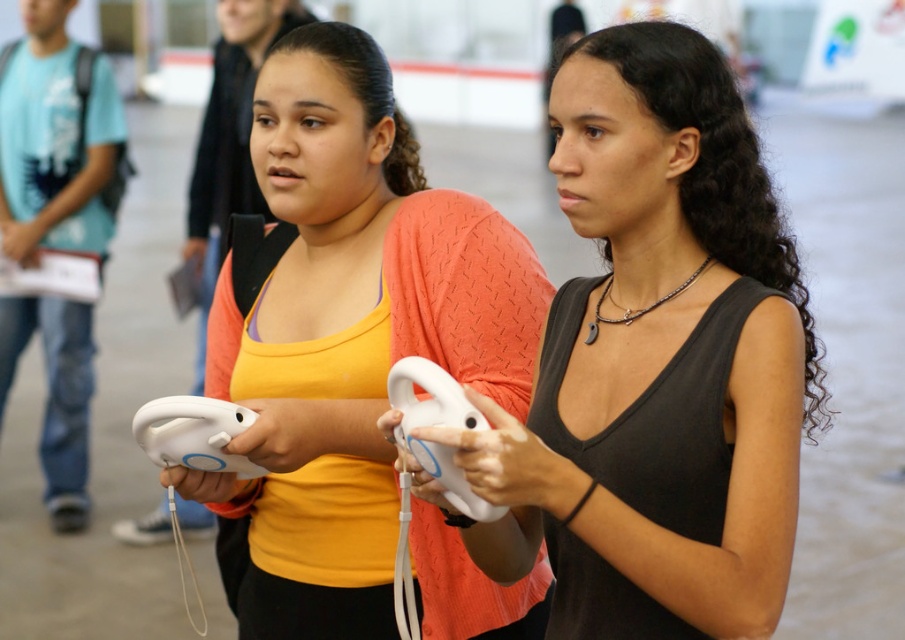
The width and height of the screenshot is (905, 640). I want to click on black matte tank top at center, so click(x=656, y=362).

Can you confirm if black matte tank top at center is taller than white matte wii controller at center?

Indeed, black matte tank top at center has a greater height compared to white matte wii controller at center.

This screenshot has height=640, width=905. What do you see at coordinates (656, 362) in the screenshot?
I see `black matte tank top at center` at bounding box center [656, 362].

Image resolution: width=905 pixels, height=640 pixels. I want to click on black matte tank top at center, so click(x=656, y=362).

Does matte white controller at center have a larger size compared to white matte wii remote at center?

Yes.

Does matte white controller at center have a greater width compared to white matte wii remote at center?

Correct, the width of matte white controller at center exceeds that of white matte wii remote at center.

Does point (375, 272) lie behind point (396, 390)?

That is True.

Find the location of a particular element. This screenshot has width=905, height=640. matte white controller at center is located at coordinates (349, 332).

Which of these two, white matte wii remote at center or white matte wii controller at center, stands shorter?

Standing shorter between the two is white matte wii controller at center.

Does white matte wii remote at center appear under white matte wii controller at center?

No.

The height and width of the screenshot is (640, 905). In order to click on white matte wii remote at center in this screenshot , I will do `click(436, 426)`.